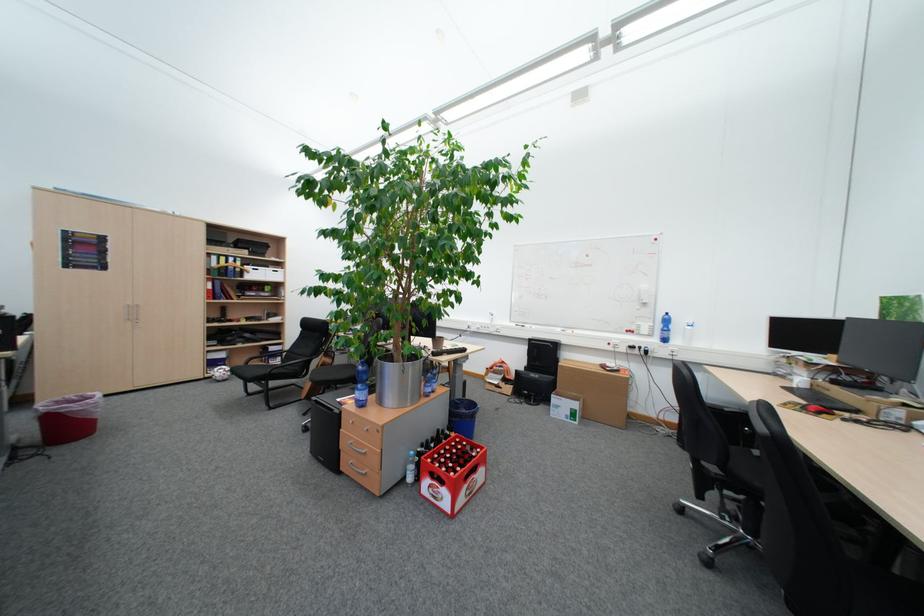
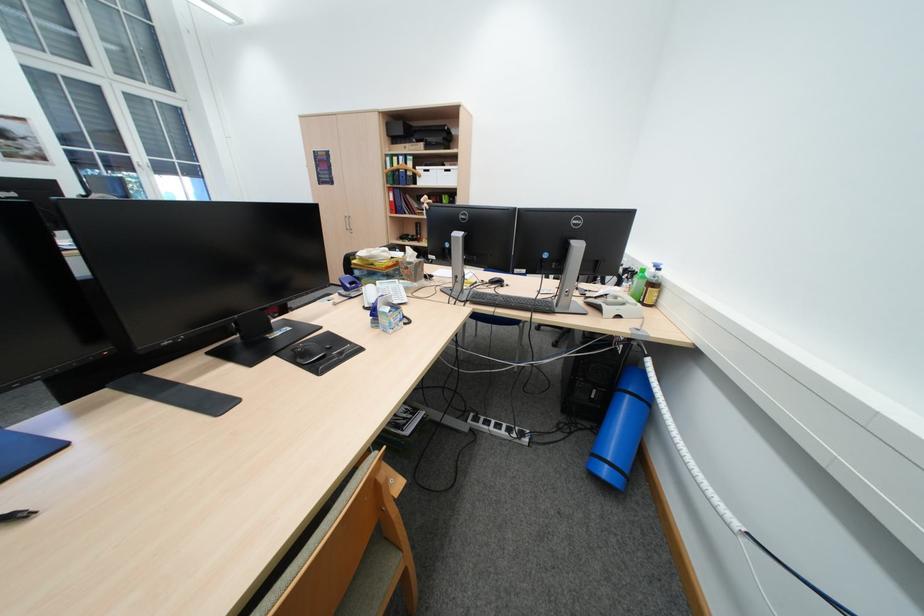
Where in the second image is the point corresponding to (238,257) from the first image?

(409, 156)